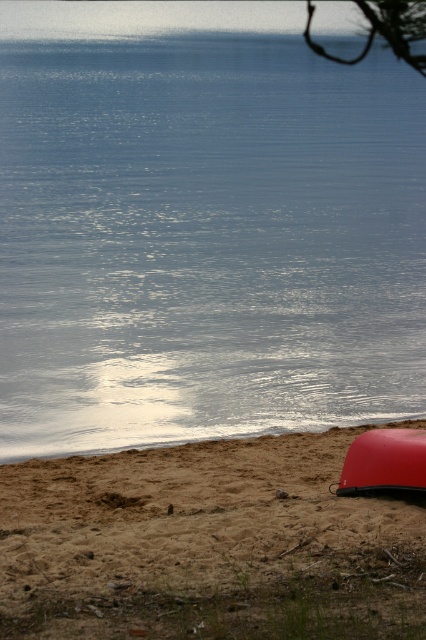
Does glistening blue water at lower center come in front of brown sandy beach at lower right?

No, glistening blue water at lower center is behind brown sandy beach at lower right.

Who is lower down, glistening blue water at lower center or brown sandy beach at lower right?

brown sandy beach at lower right is lower down.

This screenshot has width=426, height=640. Describe the element at coordinates (203, 227) in the screenshot. I see `glistening blue water at lower center` at that location.

This screenshot has height=640, width=426. Identify the location of glistening blue water at lower center. (203, 227).

Which is above, brown sandy beach at lower right or shiny red canoe at lower right?

Positioned higher is shiny red canoe at lower right.

This screenshot has width=426, height=640. I want to click on brown sandy beach at lower right, so click(x=207, y=545).

Which is in front, point (296, 412) or point (394, 458)?

Point (394, 458)

Locate an element on the screen. glistening blue water at lower center is located at coordinates (203, 227).